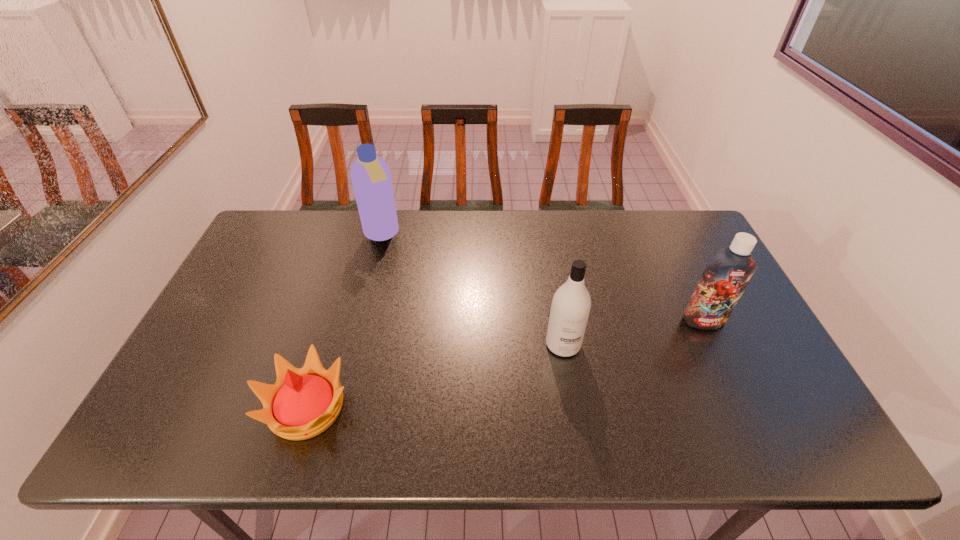
Where is `object at the far edge`? This screenshot has height=540, width=960. object at the far edge is located at coordinates (371, 178).

You are a GUI agent. You are given a task and a screenshot of the screen. Output one action in this format:
    pyautogui.click(x=<x>, y=<y>)
    Task: Click on the object that is at the near edge
    
    Given the screenshot: What is the action you would take?
    pyautogui.click(x=304, y=402)

The image size is (960, 540). Find the location of `object present at the right edge`. object present at the right edge is located at coordinates (726, 275).

Locate an element on the screen. Image resolution: width=960 pixels, height=540 pixels. vacant space at the far edge of the desktop is located at coordinates (606, 241).

The width and height of the screenshot is (960, 540). In the image, there is a desktop. Identify the location of free region at the near edge. (533, 449).

In the image, there is a desktop. Where is `vacant space at the left edge`? This screenshot has height=540, width=960. vacant space at the left edge is located at coordinates (242, 294).

Where is `blank area at the right edge`? blank area at the right edge is located at coordinates (762, 402).

What are the coordinates of `free space at the far right corner of the desktop` in the screenshot? It's located at (659, 236).

Image resolution: width=960 pixels, height=540 pixels. In order to click on vacant space at the near right corner in this screenshot , I will do [781, 429].

The image size is (960, 540). Identify the location of free space between the rightmost object and the farthest shampoo. (542, 278).